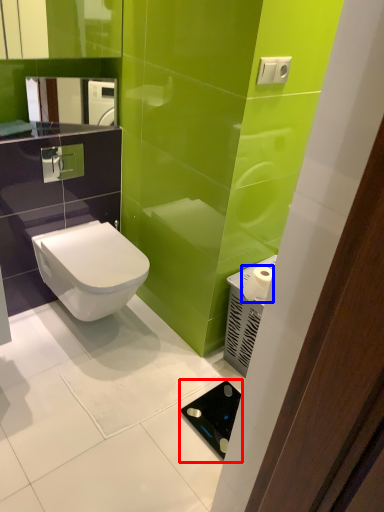
Question: Which point is further to the camera, appliance (highlighted by a red box) or toilet paper (highlighted by a blue box)?

Choices:
 (A) appliance
 (B) toilet paper

Answer: (B)